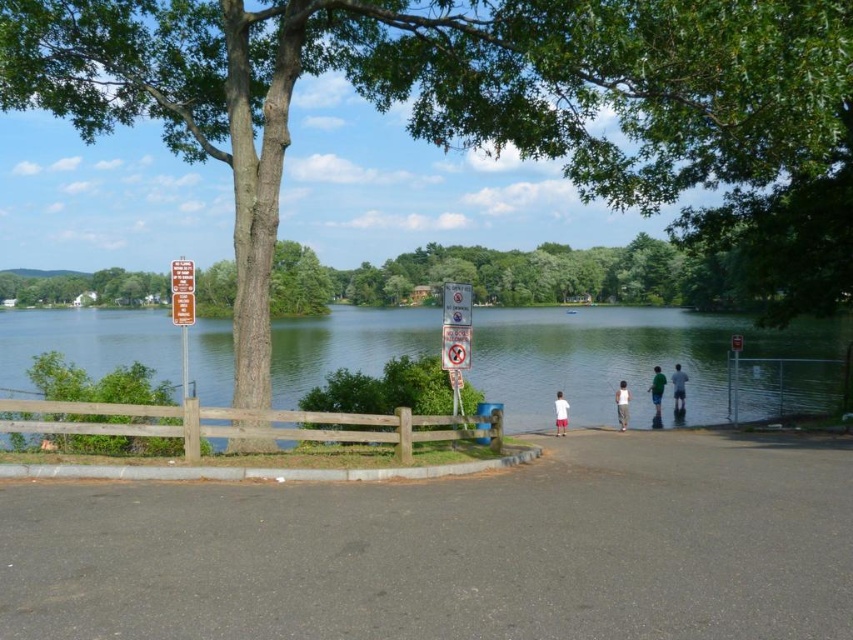
Does white cotton shirt at center have a greater width compared to green cotton shirt at lower center?

Yes, white cotton shirt at center is wider than green cotton shirt at lower center.

The image size is (853, 640). What do you see at coordinates (622, 404) in the screenshot?
I see `white cotton shirt at center` at bounding box center [622, 404].

The image size is (853, 640). In order to click on white cotton shirt at center in this screenshot , I will do `click(622, 404)`.

Can you confirm if clear water at lower center is positioned to the right of green cotton shirt at lower center?

Incorrect, clear water at lower center is not on the right side of green cotton shirt at lower center.

Is point (766, 353) farther from viewer compared to point (651, 380)?

That is True.

This screenshot has width=853, height=640. What are the coordinates of `clear water at lower center` in the screenshot? It's located at 630,360.

Can you confirm if green textured tree at center is positioned to the left of white cotton shirt at center?

Yes, green textured tree at center is to the left of white cotton shirt at center.

Find the location of a particular element. green textured tree at center is located at coordinates (445, 92).

Between point (192, 109) and point (625, 396), which one is positioned behind?

Positioned behind is point (625, 396).

This screenshot has width=853, height=640. Find the location of `green textured tree at center`. green textured tree at center is located at coordinates [445, 92].